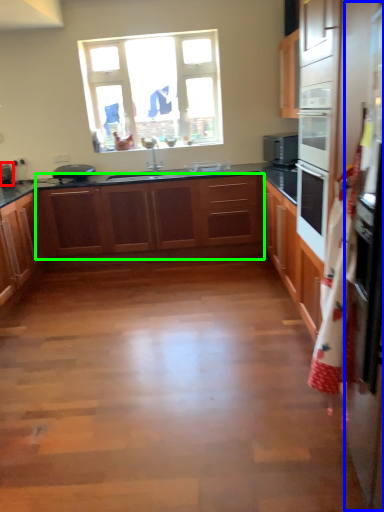
Question: Which is farther away from appliance (highlighted by a red box)? fridge (highlighted by a blue box) or cabinetry (highlighted by a green box)?

Choices:
 (A) fridge
 (B) cabinetry

Answer: (A)